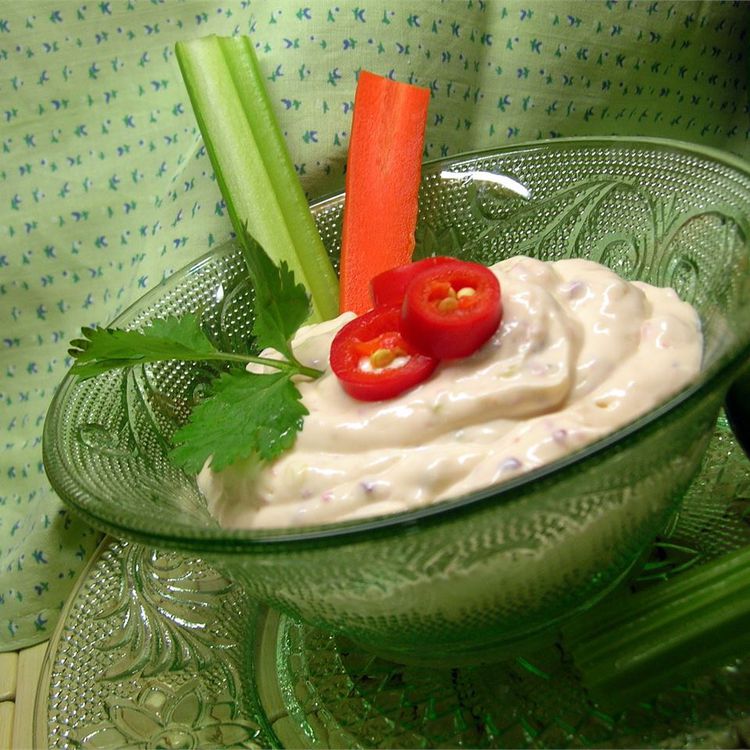
The image size is (750, 750). Identify the location of rim of glass bowl. (399, 526).